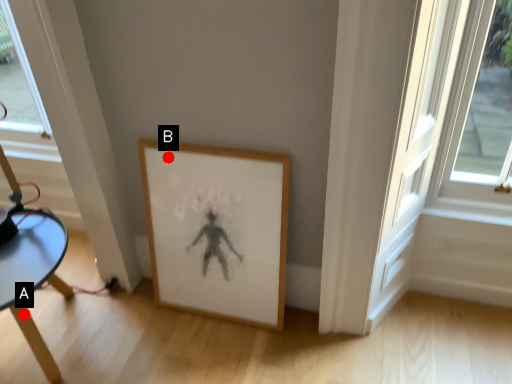
Question: Two points are circled on the image, labeled by A and B beside each circle. Among these points, which one is farthest from the camera?

Choices:
 (A) A is further
 (B) B is further

Answer: (B)